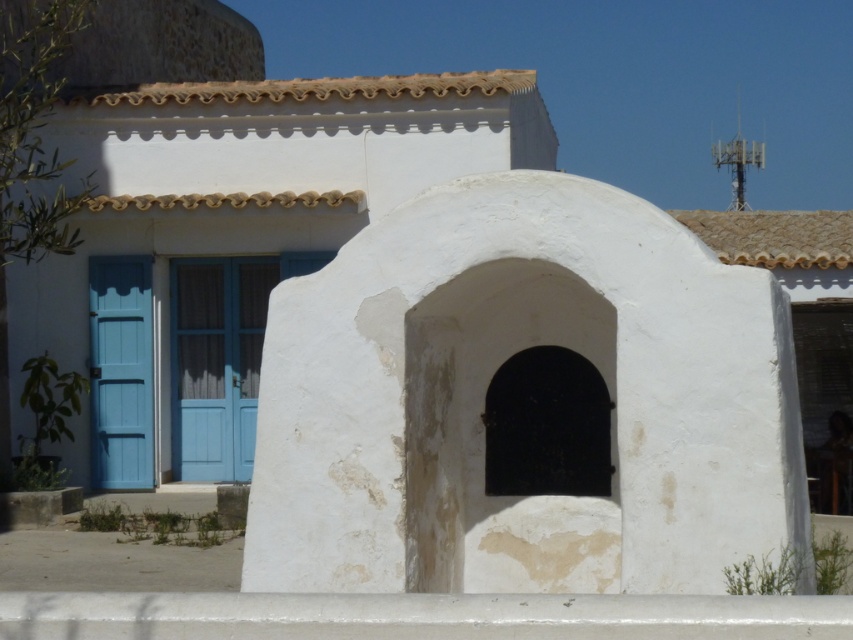
Question: Is matte blue door at center above blue painted wood door at left?

Choices:
 (A) no
 (B) yes

Answer: (B)

Question: Can you confirm if white rough stone archway at center is positioned to the left of matte blue door at center?

Choices:
 (A) yes
 (B) no

Answer: (B)

Question: Does white rough stone archway at center appear under blue painted wood door at left?

Choices:
 (A) no
 (B) yes

Answer: (A)

Question: Which point is farther from the camera taking this photo?

Choices:
 (A) (134, 440)
 (B) (625, 557)
 (C) (189, 436)

Answer: (C)

Question: Among these points, which one is farthest from the camera?

Choices:
 (A) 177,376
 (B) 437,368

Answer: (A)

Question: Which point is closer to the camera taking this photo?

Choices:
 (A) (474, 280)
 (B) (105, 461)

Answer: (A)